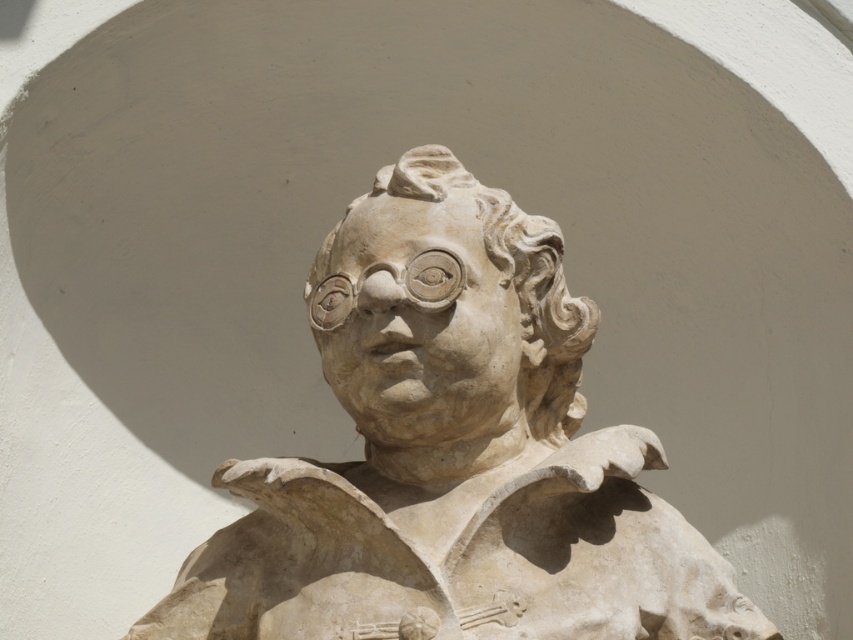
What are the coordinates of the stone sculpture at center in the image?

The stone sculpture at center is located at coordinates point (x=453, y=456).

You are an art conservator assessing the stone sculpture at center and the white stone head at center. Which object has a greater width according to the description?

The white stone head at center has a greater width than the stone sculpture at center.